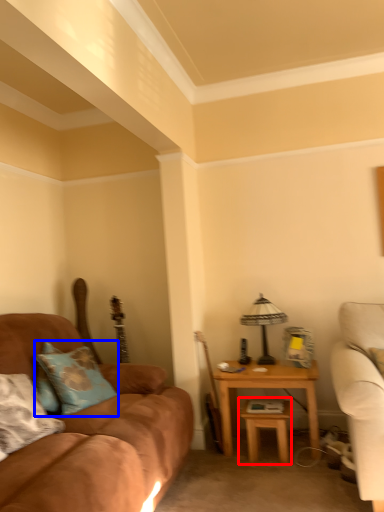
Question: Among these objects, which one is farthest to the camera, table (highlighted by a red box) or pillow (highlighted by a blue box)?

Choices:
 (A) table
 (B) pillow

Answer: (A)